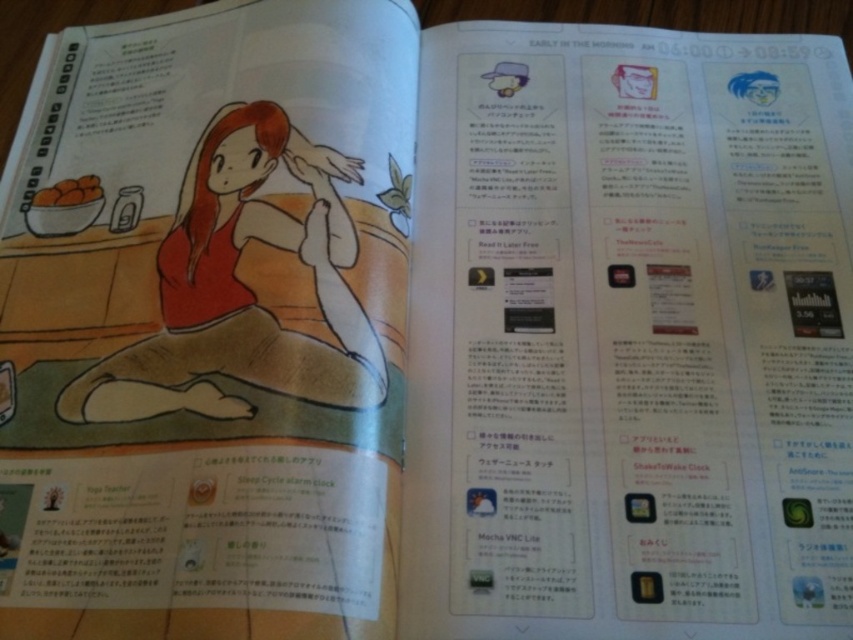
You are designing a layout for a magazine page. You have a matte red dress at center and a brown matte bowl at upper left. Given their sizes, which object should you place closer to the edge of the page to maintain visual balance?

The brown matte bowl at upper left should be placed closer to the edge of the page because it is smaller than the matte red dress at center, helping to balance the visual weight.

You are looking at the magazine page and notice two points marked on it. The first point is at coordinate point (218, 390) and the second is at coordinate point (86, 173). Based on their positions, which point is closer to you?

Point (218, 390) is in front of point (86, 173), so it is closer to you.

You are an art student analyzing the layout of this magazine page. You notice the matte red dress at center and the brown matte bowl at upper left. Which object appears closer to the viewer in the illustration?

The matte red dress at center appears closer to the viewer than the brown matte bowl at upper left because it is positioned in front of it in the illustration.